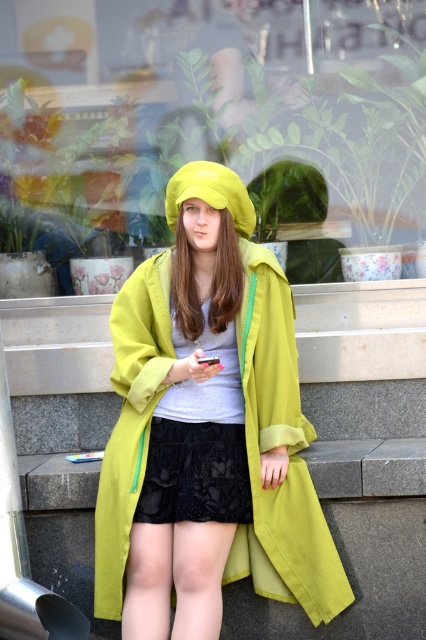
What are the coordinates of the transparent glass shop window at center?

The transparent glass shop window at center is located at coordinates (218, 120).

You are a fashion designer observing a person wearing a matte green coat at center and black lace shorts at center. Which clothing item takes up more space on the person?

The matte green coat at center has a larger size compared to black lace shorts at center, so the matte green coat at center takes up more space on the person.